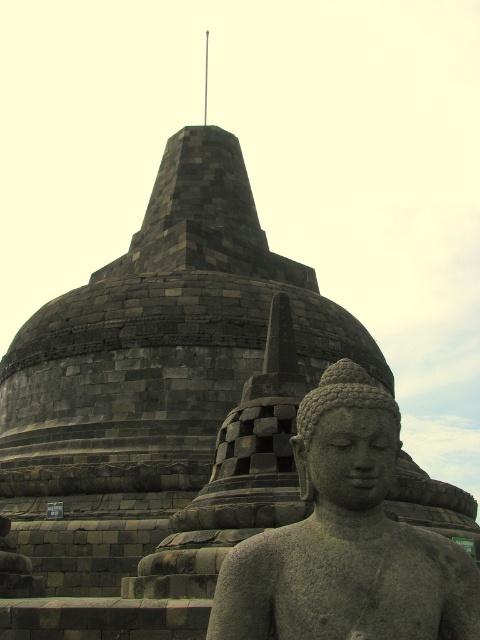
Question: Which point is closer to the camera?

Choices:
 (A) (352, 460)
 (B) (362, 472)

Answer: (B)

Question: Is gray stone statue at center to the right of gray stone buddha at center from the viewer's perspective?

Choices:
 (A) no
 (B) yes

Answer: (B)

Question: Where is gray stone statue at center located in relation to gray stone buddha at center in the image?

Choices:
 (A) below
 (B) above

Answer: (A)

Question: Is gray stone statue at center wider than gray stone buddha at center?

Choices:
 (A) no
 (B) yes

Answer: (B)

Question: Which point is closer to the camera taking this photo?

Choices:
 (A) (252, 545)
 (B) (317, 422)

Answer: (A)

Question: Which of the following is the farthest from the observer?

Choices:
 (A) gray stone statue at center
 (B) gray stone buddha at center

Answer: (B)